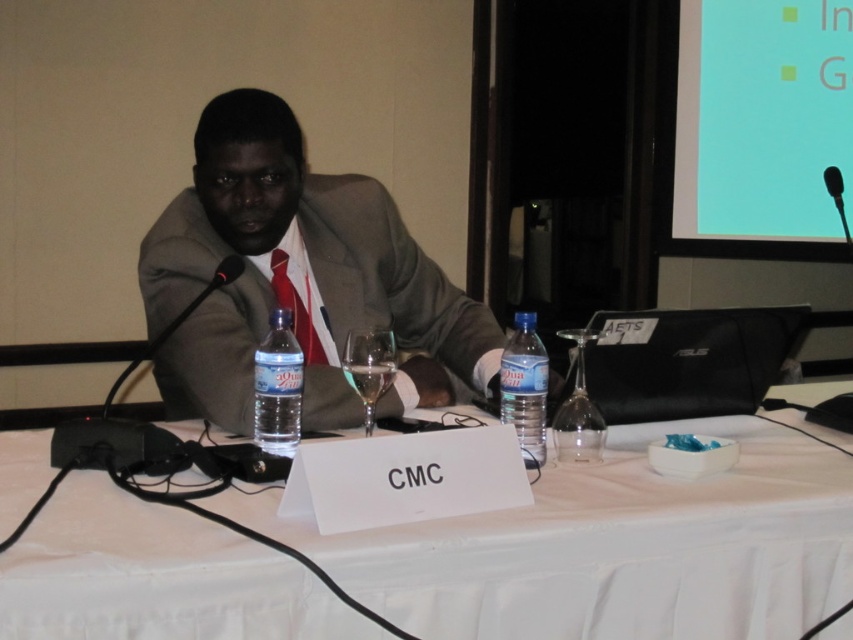
Can you confirm if matte gray suit at center is positioned above clear plastic water bottle at center?

Yes, matte gray suit at center is above clear plastic water bottle at center.

Describe the element at coordinates (296, 276) in the screenshot. I see `matte gray suit at center` at that location.

At what (x,y) coordinates should I click in order to perform the action: click on matte gray suit at center. Please return your answer as a coordinate pair (x, y). Looking at the image, I should click on (296, 276).

Is the position of white paper at center more distant than that of red silk tie at center?

That is False.

Who is lower down, white paper at center or red silk tie at center?

Positioned lower is white paper at center.

Which is in front, point (619, 611) or point (273, 280)?

Point (619, 611)

The width and height of the screenshot is (853, 640). In order to click on white paper at center in this screenshot , I will do `click(611, 547)`.

Which is above, red silk tie at center or black plastic microphone at upper right?

Positioned higher is black plastic microphone at upper right.

Who is more distant from viewer, (x=282, y=292) or (x=828, y=164)?

Point (x=828, y=164)

Does point (292, 321) lie behind point (845, 241)?

That is False.

The width and height of the screenshot is (853, 640). I want to click on red silk tie at center, so click(x=294, y=308).